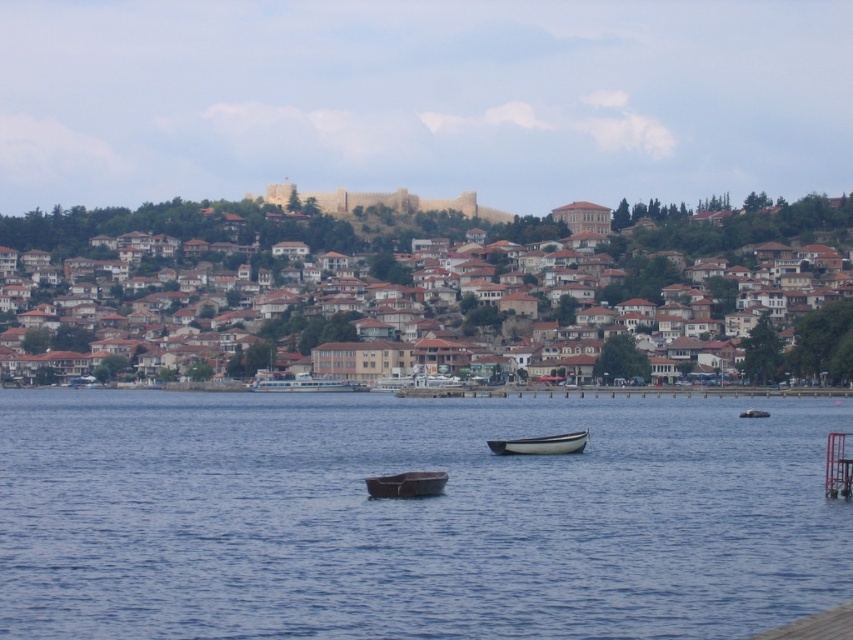
Question: Which of the following is the farthest from the observer?

Choices:
 (A) white glossy ferry at center
 (B) brown clay houses at upper center

Answer: (A)

Question: Based on their relative distances, which object is farther from the white glossy ferry at center?

Choices:
 (A) blue water at center
 (B) brown clay houses at upper center
 (C) wooden boat at center
 (D) white plastic boat at center

Answer: (C)

Question: Is white plastic boat at center wider than metallic gray boat at center?

Choices:
 (A) yes
 (B) no

Answer: (A)

Question: Does blue water at center have a lesser width compared to wooden boat at center?

Choices:
 (A) no
 (B) yes

Answer: (A)

Question: Is brown clay houses at upper center above metallic gray boat at center?

Choices:
 (A) no
 (B) yes

Answer: (B)

Question: Estimate the real-world distances between objects in this image. Which object is farther from the wooden boat at center?

Choices:
 (A) white glossy ferry at center
 (B) white plastic boat at center

Answer: (A)